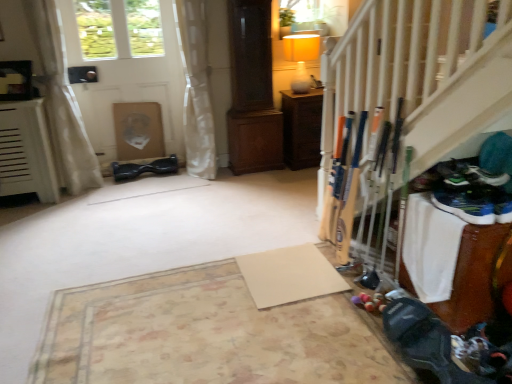
Question: Can you confirm if wooden cabinet at center is smaller than white sheer curtain at left, which is the 1th curtain from left to right?

Choices:
 (A) yes
 (B) no

Answer: (A)

Question: Is wooden cabinet at center thinner than white sheer curtain at left, the second curtain from the right?

Choices:
 (A) no
 (B) yes

Answer: (A)

Question: Is wooden cabinet at center oriented away from white sheer curtain at left, the second curtain from the right?

Choices:
 (A) yes
 (B) no

Answer: (B)

Question: From the image's perspective, is wooden cabinet at center on top of white sheer curtain at left, which is the 1th curtain from left to right?

Choices:
 (A) no
 (B) yes

Answer: (A)

Question: From a real-world perspective, does wooden cabinet at center stand above white sheer curtain at left, which is the 1th curtain from left to right?

Choices:
 (A) no
 (B) yes

Answer: (A)

Question: From the image's perspective, is black rubber hoverboard at center located above or below white matte door at upper left?

Choices:
 (A) below
 (B) above

Answer: (A)

Question: Is black rubber hoverboard at center taller or shorter than white matte door at upper left?

Choices:
 (A) short
 (B) tall

Answer: (A)

Question: From a real-world perspective, relative to white matte door at upper left, is black rubber hoverboard at center vertically above or below?

Choices:
 (A) above
 (B) below

Answer: (B)

Question: Is black rubber hoverboard at center in front of or behind white matte door at upper left in the image?

Choices:
 (A) behind
 (B) front

Answer: (A)

Question: Do you think wooden cabinet at center is within white sheer curtain at left, which is the 1th curtain from left to right, or outside of it?

Choices:
 (A) inside
 (B) outside

Answer: (B)

Question: In terms of size, does wooden cabinet at center appear bigger or smaller than white sheer curtain at left, which is the 1th curtain from left to right?

Choices:
 (A) small
 (B) big

Answer: (A)

Question: Looking at their shapes, would you say wooden cabinet at center is wider or thinner than white sheer curtain at left, which is the 1th curtain from left to right?

Choices:
 (A) wide
 (B) thin

Answer: (A)

Question: From the image's perspective, is wooden cabinet at center positioned above or below white sheer curtain at left, the second curtain from the right?

Choices:
 (A) above
 (B) below

Answer: (B)

Question: From the image's perspective, relative to white sheer curtain at left, the second curtain from the right, is black rubber hoverboard at center above or below?

Choices:
 (A) below
 (B) above

Answer: (A)

Question: In the image, is black rubber hoverboard at center positioned in front of or behind white sheer curtain at left, which is the 1th curtain from left to right?

Choices:
 (A) front
 (B) behind

Answer: (B)